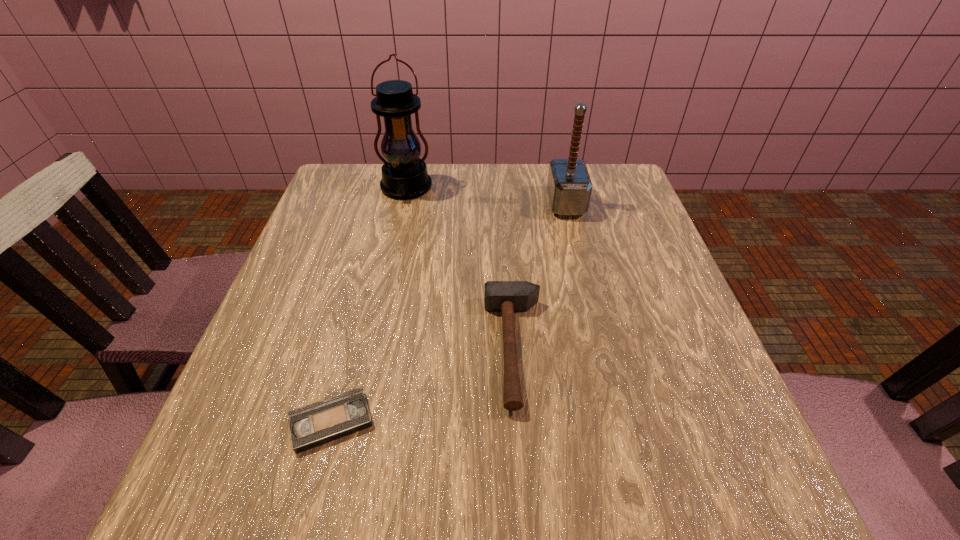
In order to click on vacant point located between the videotape and the left hammer in this screenshot , I will do `click(423, 384)`.

Where is `free space between the rightmost object and the lantern`? free space between the rightmost object and the lantern is located at coordinates (486, 195).

What are the coordinates of `free point between the rightmost object and the tallest object` in the screenshot? It's located at (486, 195).

Identify the location of vacant space that's between the nearer hammer and the shortest object. (423, 384).

This screenshot has width=960, height=540. I want to click on empty space between the shortest object and the farther hammer, so click(448, 312).

Where is `empty space between the second tallest object and the shortest object`? empty space between the second tallest object and the shortest object is located at coordinates (448, 312).

Image resolution: width=960 pixels, height=540 pixels. Find the location of `vacant region between the lantern and the second shortest object`. vacant region between the lantern and the second shortest object is located at coordinates (461, 268).

Find the location of `free spot between the nearer hammer and the shortest object`. free spot between the nearer hammer and the shortest object is located at coordinates (423, 384).

I want to click on free space between the tallest object and the videotape, so click(x=369, y=305).

Identify the location of object that is the second nearest to the tallest object. (507, 297).